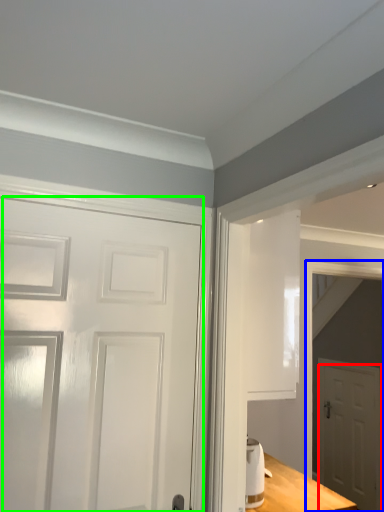
Question: Which is nearer to the door (highlighted by a red box)? elevator (highlighted by a blue box) or door (highlighted by a green box).

Choices:
 (A) elevator
 (B) door

Answer: (A)